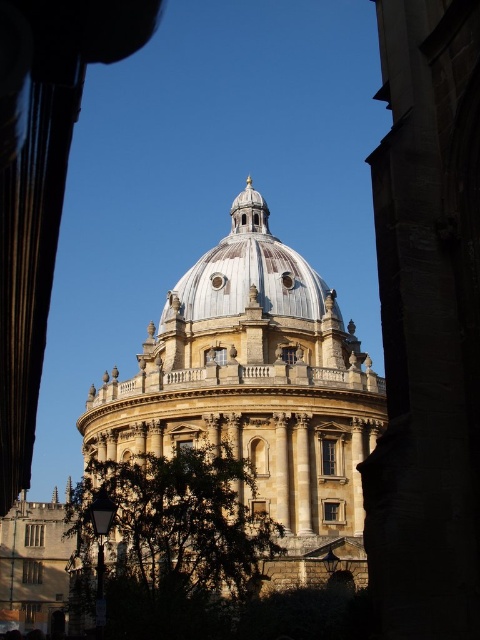
Measure the distance between golden stone dome at center and camera.

golden stone dome at center is 52.73 meters from camera.

Can you confirm if golden stone dome at center is positioned to the left of green leafy tree at lower left?

Incorrect, golden stone dome at center is not on the left side of green leafy tree at lower left.

At what (x,y) coordinates should I click in order to perform the action: click on golden stone dome at center. Please return your answer as a coordinate pair (x, y). Looking at the image, I should click on (255, 392).

I want to click on golden stone dome at center, so click(255, 392).

Between point (307, 330) and point (260, 243), which one is positioned behind?

Point (260, 243)

Which is in front, point (101, 419) or point (231, 285)?

Point (101, 419) is more forward.

You are a GUI agent. You are given a task and a screenshot of the screen. Output one action in this format:
    pyautogui.click(x=<x>, y=<y>)
    Task: Click on the golden stone dome at center
    
    Given the screenshot: What is the action you would take?
    pyautogui.click(x=255, y=392)

Who is more forward, (243, 476) or (227, 307)?

Point (243, 476) is more forward.

Between point (269, 525) and point (259, 259), which one is positioned behind?

Positioned behind is point (259, 259).

Which is in front, point (113, 484) or point (188, 269)?

Point (113, 484)

This screenshot has height=640, width=480. What are the coordinates of `green leafy tree at lower left` in the screenshot? It's located at (168, 544).